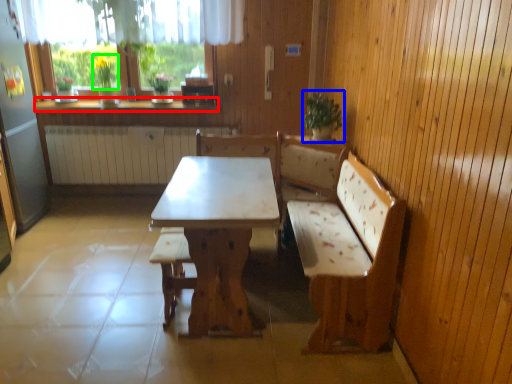
Question: Based on their relative distances, which object is nearer to counter top (highlighted by a red box)? Choose from houseplant (highlighted by a blue box) and plant (highlighted by a green box).

Choices:
 (A) houseplant
 (B) plant

Answer: (B)